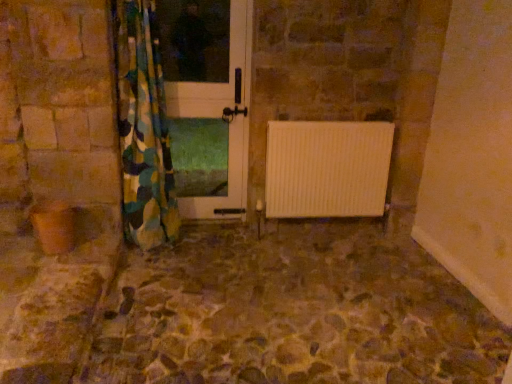
Question: Is stone textured floor at center located outside camouflage fabric curtain at left?

Choices:
 (A) no
 (B) yes

Answer: (B)

Question: Considering the relative sizes of stone textured floor at center and camouflage fabric curtain at left in the image provided, is stone textured floor at center thinner than camouflage fabric curtain at left?

Choices:
 (A) yes
 (B) no

Answer: (B)

Question: Can you confirm if stone textured floor at center is smaller than camouflage fabric curtain at left?

Choices:
 (A) no
 (B) yes

Answer: (B)

Question: From a real-world perspective, is stone textured floor at center physically below camouflage fabric curtain at left?

Choices:
 (A) yes
 (B) no

Answer: (A)

Question: Is stone textured floor at center in front of camouflage fabric curtain at left?

Choices:
 (A) yes
 (B) no

Answer: (A)

Question: From the image's perspective, is camouflage fabric curtain at left located above or below white glossy door at center?

Choices:
 (A) above
 (B) below

Answer: (B)

Question: Is camouflage fabric curtain at left inside or outside of white glossy door at center?

Choices:
 (A) outside
 (B) inside

Answer: (A)

Question: In terms of size, does camouflage fabric curtain at left appear bigger or smaller than white glossy door at center?

Choices:
 (A) small
 (B) big

Answer: (B)

Question: Visually, is camouflage fabric curtain at left positioned to the left or to the right of white glossy door at center?

Choices:
 (A) left
 (B) right

Answer: (A)

Question: Is white glossy door at center wider or thinner than camouflage fabric curtain at left?

Choices:
 (A) wide
 (B) thin

Answer: (B)

Question: Is white glossy door at center in front of or behind camouflage fabric curtain at left in the image?

Choices:
 (A) front
 (B) behind

Answer: (B)

Question: Considering the positions of white glossy door at center and camouflage fabric curtain at left in the image, is white glossy door at center bigger or smaller than camouflage fabric curtain at left?

Choices:
 (A) small
 (B) big

Answer: (A)

Question: Considering the relative positions of white glossy door at center and camouflage fabric curtain at left in the image provided, is white glossy door at center to the left or to the right of camouflage fabric curtain at left?

Choices:
 (A) left
 (B) right

Answer: (B)

Question: From the image's perspective, is stone textured floor at center positioned above or below white glossy door at center?

Choices:
 (A) above
 (B) below

Answer: (B)

Question: Is stone textured floor at center in front of or behind white glossy door at center in the image?

Choices:
 (A) behind
 (B) front

Answer: (B)